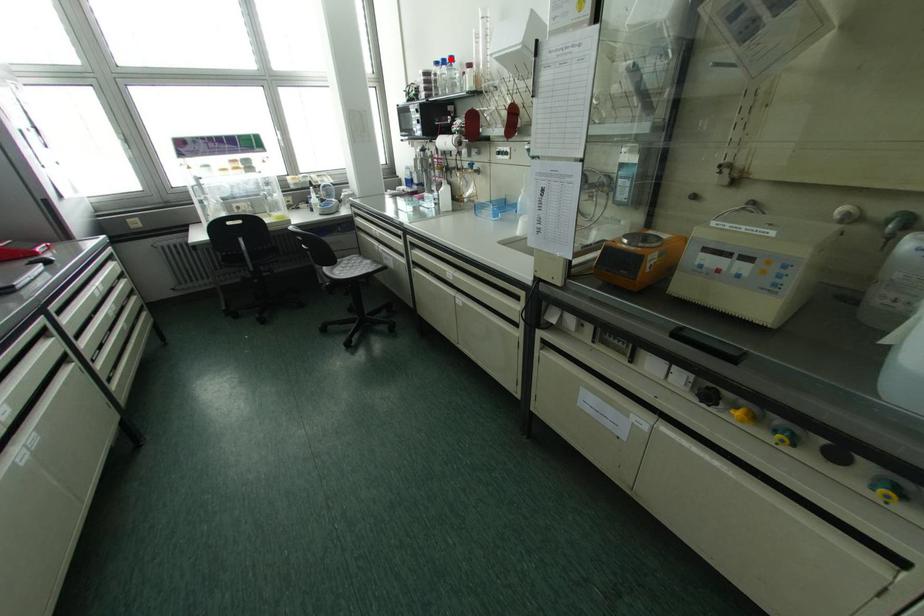
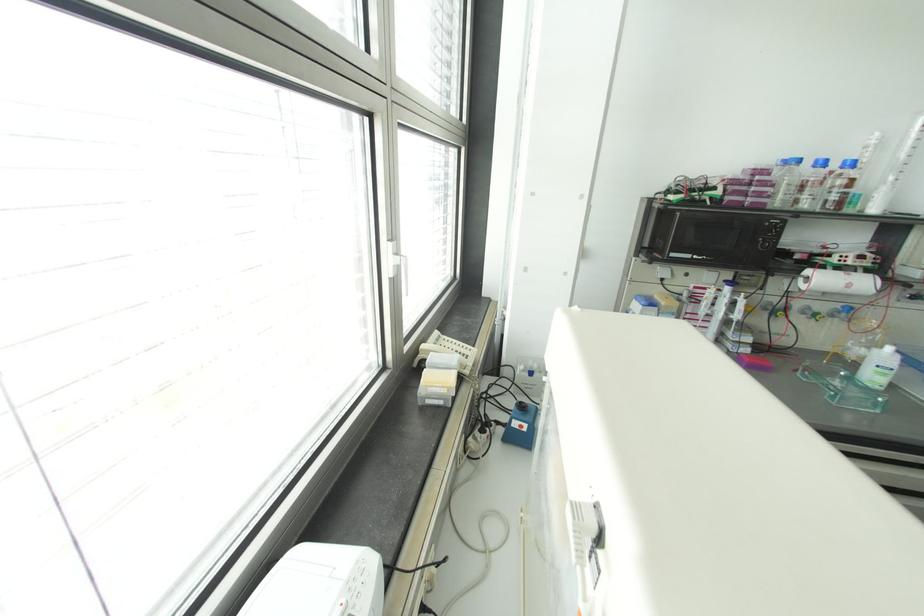
Question: I am providing you with two images of the same scene from different viewpoints. Image1 has a red point marked. In image2, the corresponding 3D location appears at what relative position? Reply with the corresponding letter.

Choices:
 (A) Closer
 (B) Farther

Answer: (B)